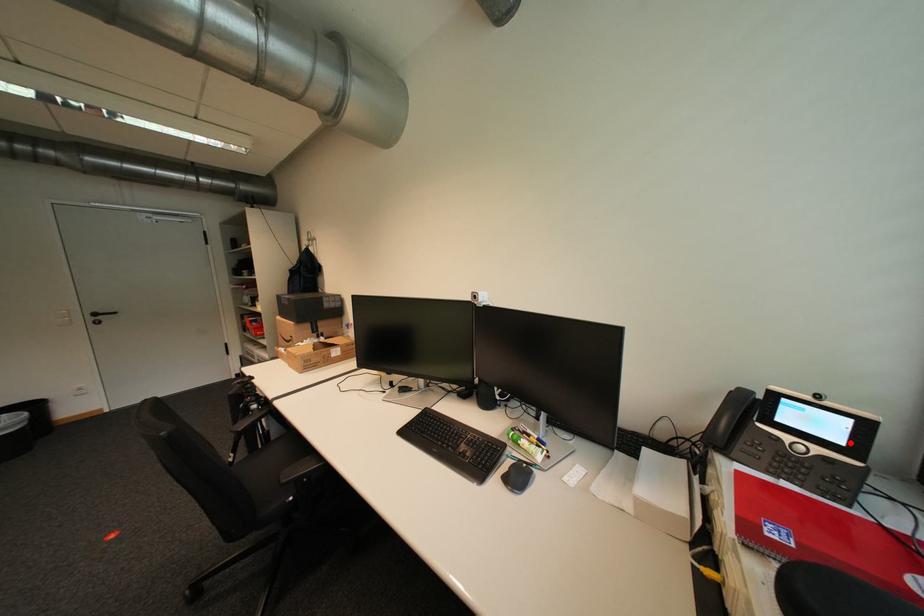
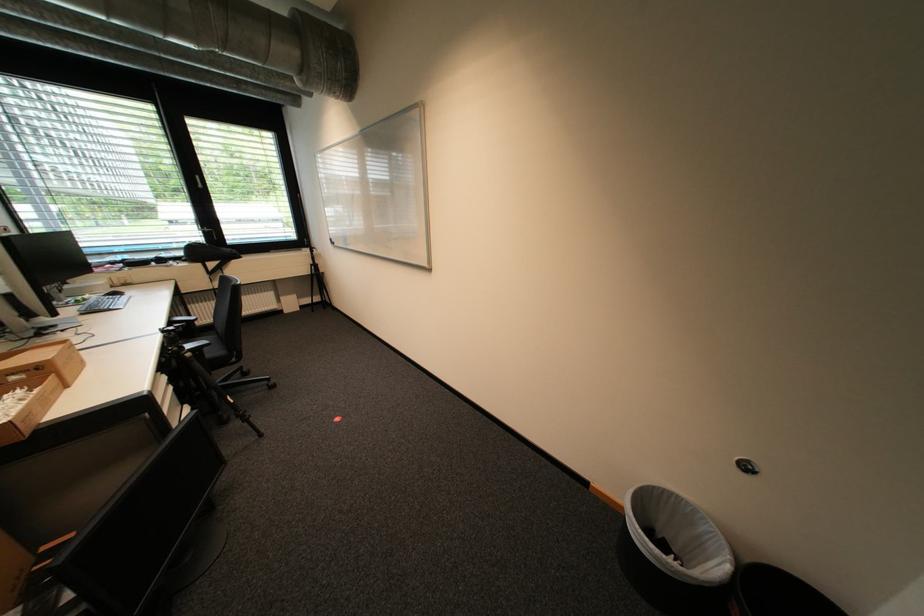
Question: I am providing you with two images of the same scene from different viewpoints. A red point is marked on the first image. At the location where the point appears in image 1, is it still visible in image 2?

Choices:
 (A) Yes
 (B) No

Answer: (B)